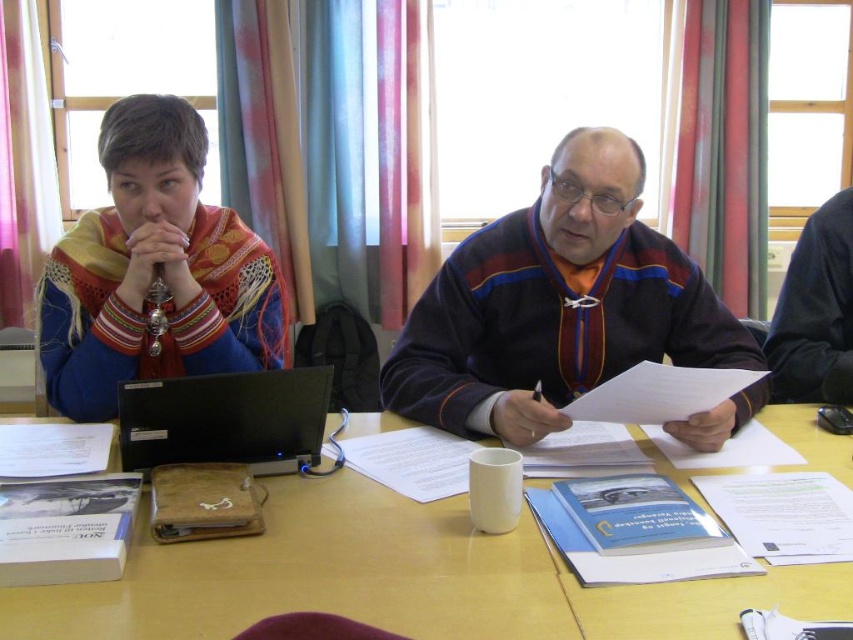
Question: Among these objects, which one is farthest from the camera?

Choices:
 (A) wooden table at center
 (B) white paper at center

Answer: (B)

Question: Does wooden table at center appear on the right side of matte black sweater at center?

Choices:
 (A) no
 (B) yes

Answer: (A)

Question: Can you confirm if black glossy laptop at center is thinner than white paper at center?

Choices:
 (A) no
 (B) yes

Answer: (B)

Question: Does black glossy laptop at center have a lesser width compared to white paper at center?

Choices:
 (A) yes
 (B) no

Answer: (A)

Question: Which point is farther to the camera?

Choices:
 (A) matte black sweater at center
 (B) wooden table at center

Answer: (A)

Question: Which object is closer to the camera taking this photo?

Choices:
 (A) matte black sweater at center
 (B) white paper at center

Answer: (B)